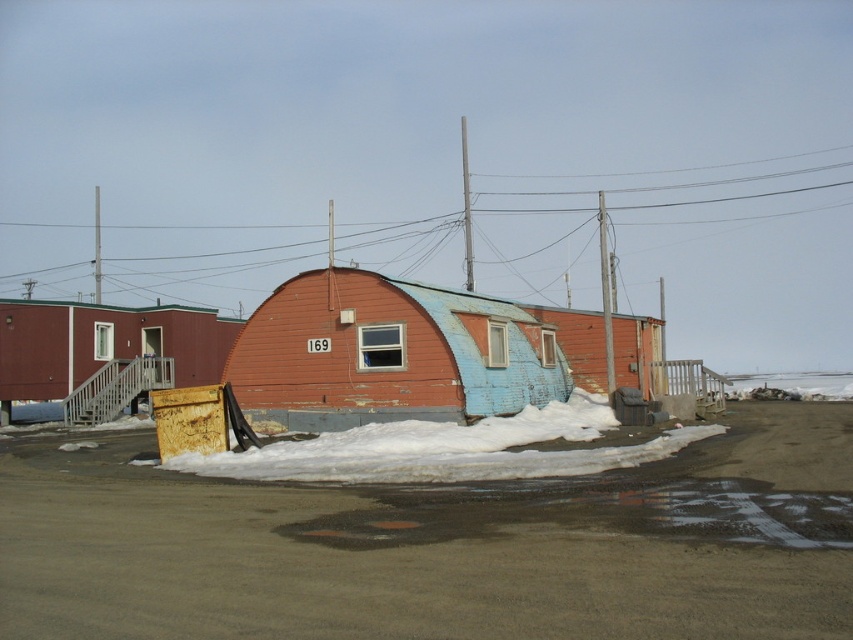
Question: Which point is closer to the camera taking this photo?

Choices:
 (A) (421, 292)
 (B) (62, 301)
 (C) (456, 444)

Answer: (C)

Question: Is rusty corrugated metal hut at center bigger than rusty metal dumpster at left?

Choices:
 (A) no
 (B) yes

Answer: (A)

Question: Which point appears farthest from the camera in this image?

Choices:
 (A) (543, 248)
 (B) (149, 321)

Answer: (A)

Question: Can you confirm if white powdery snow at center is positioned to the right of metallic wire at upper center?

Choices:
 (A) yes
 (B) no

Answer: (A)

Question: Which point is farther to the camera?

Choices:
 (A) rusty corrugated metal hut at center
 (B) rusty metal dumpster at left
 (C) metallic wire at upper center

Answer: (C)

Question: Is rusty metal dumpster at left in front of metallic wire at upper center?

Choices:
 (A) yes
 (B) no

Answer: (A)